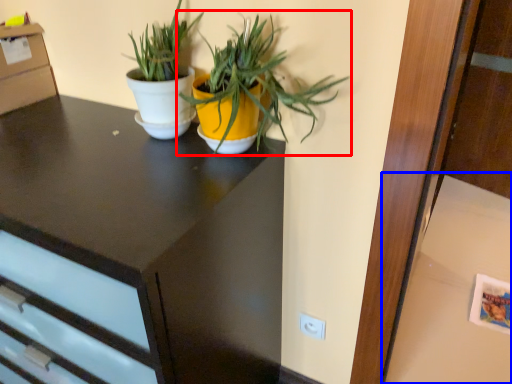
Question: Which object appears farthest to the camera in this image, houseplant (highlighted by a red box) or table (highlighted by a blue box)?

Choices:
 (A) houseplant
 (B) table

Answer: (B)